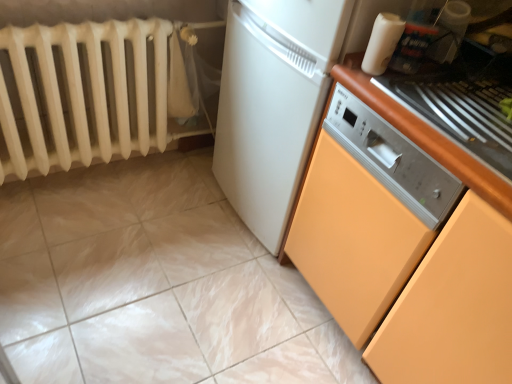
What do you see at coordinates (154, 284) in the screenshot?
I see `white glossy tile at lower center` at bounding box center [154, 284].

The image size is (512, 384). Find the location of `orange matte countertop at right`. orange matte countertop at right is located at coordinates (425, 136).

Identify the location of white glossy dishwasher at center. The image size is (512, 384). (280, 97).

Describe the element at coordinates (382, 42) in the screenshot. The image size is (512, 384). I see `white glossy plastic container at upper right` at that location.

In order to click on white matte radiator at left in this screenshot , I will do `click(83, 93)`.

From the picture: Is white matte radiator at left taller or shorter than orange matte countertop at right?

white matte radiator at left is taller than orange matte countertop at right.

Does white matte radiator at left turn towards orange matte countertop at right?

Yes, white matte radiator at left is aimed at orange matte countertop at right.

Can you confirm if white matte radiator at left is bigger than orange matte countertop at right?

Correct, white matte radiator at left is larger in size than orange matte countertop at right.

Considering the positions of objects white matte radiator at left and orange matte countertop at right in the image provided, who is more to the right, white matte radiator at left or orange matte countertop at right?

From the viewer's perspective, orange matte countertop at right appears more on the right side.

Is white matte radiator at left completely or partially inside white glossy dishwasher at center?

Definitely not — white matte radiator at left is not inside white glossy dishwasher at center.

Are white glossy dishwasher at center and white matte radiator at left making contact?

No, white glossy dishwasher at center is not making contact with white matte radiator at left.

Identify the location of radiator that is on the left side of white glossy dishwasher at center. Image resolution: width=512 pixels, height=384 pixels. (83, 93).

What's the angular difference between white glossy dishwasher at center and white matte radiator at left's facing directions?

The angle between the facing direction of white glossy dishwasher at center and the facing direction of white matte radiator at left is 89.9 degrees.

Is white matte radiator at left located outside white glossy dishwasher at center?

Yes.

Is white glossy dishwasher at center at the back of white matte radiator at left?

That's not correct — white matte radiator at left is not looking away from white glossy dishwasher at center.

Which object is closer to the camera taking this photo, white matte radiator at left or white glossy dishwasher at center?

white glossy dishwasher at center is more forward.

Does white glossy tile at lower center turn towards orange matte countertop at right?

No.

From the image's perspective, is white glossy tile at lower center located above or below orange matte countertop at right?

Based on their image positions, white glossy tile at lower center is located beneath orange matte countertop at right.

From their relative heights in the image, would you say white glossy tile at lower center is taller or shorter than orange matte countertop at right?

Clearly, white glossy tile at lower center is shorter compared to orange matte countertop at right.

Is white glossy tile at lower center spatially inside orange matte countertop at right, or outside of it?

white glossy tile at lower center is spatially situated outside orange matte countertop at right.

Is orange matte cabinet at right not near white glossy plastic container at upper right?

No.

Between orange matte cabinet at right and white glossy plastic container at upper right, which one appears on the right side from the viewer's perspective?

orange matte cabinet at right is more to the right.

Is orange matte cabinet at right not inside white glossy plastic container at upper right?

Absolutely, orange matte cabinet at right is external to white glossy plastic container at upper right.

From the image's perspective, which one is positioned higher, white glossy plastic container at upper right or white matte radiator at left?

white glossy plastic container at upper right is shown above in the image.

Who is shorter, white glossy plastic container at upper right or white matte radiator at left?

Standing shorter between the two is white glossy plastic container at upper right.

Which is more to the right, white glossy plastic container at upper right or white matte radiator at left?

Positioned to the right is white glossy plastic container at upper right.

Could you tell me if white glossy plastic container at upper right is turned towards white matte radiator at left?

No, white glossy plastic container at upper right is not facing towards white matte radiator at left.

From the picture: Between white glossy tile at lower center and white matte radiator at left, which one is positioned in front?

white glossy tile at lower center is more forward.

Considering the relative sizes of white glossy tile at lower center and white matte radiator at left in the image provided, is white glossy tile at lower center wider than white matte radiator at left?

Yes.

Is white glossy tile at lower center turned away from white matte radiator at left?

That's not correct — white glossy tile at lower center is not looking away from white matte radiator at left.

Does point (87, 274) come behind point (74, 119)?

No, (87, 274) is in front of (74, 119).

You are a GUI agent. You are given a task and a screenshot of the screen. Output one action in this format:
    pyautogui.click(x=<x>, y=<y>)
    Task: Click on the counter top on the right of white matte radiator at left
    This screenshot has height=384, width=512.
    Given the screenshot: What is the action you would take?
    pyautogui.click(x=425, y=136)

This screenshot has height=384, width=512. In order to click on radiator on the left of the white glossy dishwasher at center in this screenshot , I will do `click(83, 93)`.

From the image, which object appears to be farther from orange matte cabinet at right, white glossy plastic container at upper right or orange matte countertop at right?

A: white glossy plastic container at upper right is positioned further to the anchor orange matte cabinet at right.

Considering their positions, is white matte radiator at left positioned further to white glossy plastic container at upper right than orange matte countertop at right?

white matte radiator at left is positioned further to the anchor white glossy plastic container at upper right.

From the picture: When comparing their distances from white glossy dishwasher at center, does orange matte cabinet at right or white glossy plastic container at upper right seem further?

white glossy plastic container at upper right is positioned further to the anchor white glossy dishwasher at center.

From the image, which object appears to be nearer to white glossy dishwasher at center, white glossy tile at lower center or orange matte countertop at right?

The object closer to white glossy dishwasher at center is orange matte countertop at right.

Estimate the real-world distances between objects in this image. Which object is further from orange matte cabinet at right, white glossy tile at lower center or white glossy dishwasher at center?

Among the two, white glossy tile at lower center is located further to orange matte cabinet at right.

From the image, which object appears to be nearer to white matte radiator at left, white glossy tile at lower center or orange matte cabinet at right?

Among the two, white glossy tile at lower center is located nearer to white matte radiator at left.

Which object lies further to the anchor point white glossy dishwasher at center, white glossy tile at lower center or orange matte cabinet at right?

Based on the image, white glossy tile at lower center appears to be further to white glossy dishwasher at center.

From the image, which object appears to be nearer to white glossy plastic container at upper right, white glossy tile at lower center or orange matte cabinet at right?

orange matte cabinet at right.

Locate an element on the screen. This screenshot has height=384, width=512. counter top between white glossy dishwasher at center and orange matte cabinet at right vertically is located at coordinates (425, 136).

What are the coordinates of `ceramic tile between white matte radiator at left and orange matte cabinet at right` in the screenshot? It's located at (154, 284).

Locate an element on the screen. The image size is (512, 384). cabinetry between white matte radiator at left and orange matte countertop at right is located at coordinates (408, 255).

At what (x,y) coordinates should I click in order to perform the action: click on kitchen appliance located between white glossy tile at lower center and orange matte cabinet at right in the left-right direction. Please return your answer as a coordinate pair (x, y). This screenshot has height=384, width=512. Looking at the image, I should click on (382, 42).